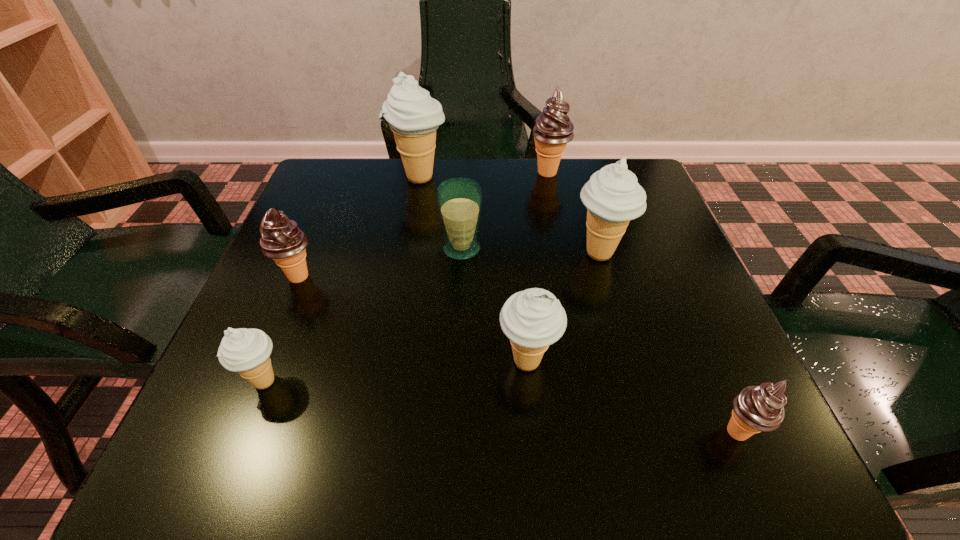
You are a GUI agent. You are given a task and a screenshot of the screen. Output one action in this format:
    pyautogui.click(x=<x>, y=<y>)
    Task: Click on the vacant space positioned on the left of the rightmost icecream
    
    Given the screenshot: What is the action you would take?
    pyautogui.click(x=674, y=433)

Find the location of a particular element. The image size is (960, 540). object present at the near edge is located at coordinates (760, 408).

The height and width of the screenshot is (540, 960). I want to click on object that is at the near right corner, so click(760, 408).

The height and width of the screenshot is (540, 960). Identify the location of vacant space at the far edge. (580, 192).

In the image, there is a desktop. Identify the location of free space at the left edge. The width and height of the screenshot is (960, 540). (328, 249).

Locate an element on the screen. The height and width of the screenshot is (540, 960). free space at the right edge of the desktop is located at coordinates (727, 410).

In the image, there is a desktop. In order to click on vacant area at the far left corner in this screenshot , I will do `click(327, 174)`.

Identify the location of free space between the second beige icecream from right to left and the third smallest beige icecream. This screenshot has height=540, width=960. (564, 307).

Locate an element on the screen. empty location between the tallest icecream and the second nearest chocolate icecream is located at coordinates (359, 227).

Where is `vacant space in between the second beige icecream from right to left and the biggest beige icecream`? The height and width of the screenshot is (540, 960). vacant space in between the second beige icecream from right to left and the biggest beige icecream is located at coordinates (473, 269).